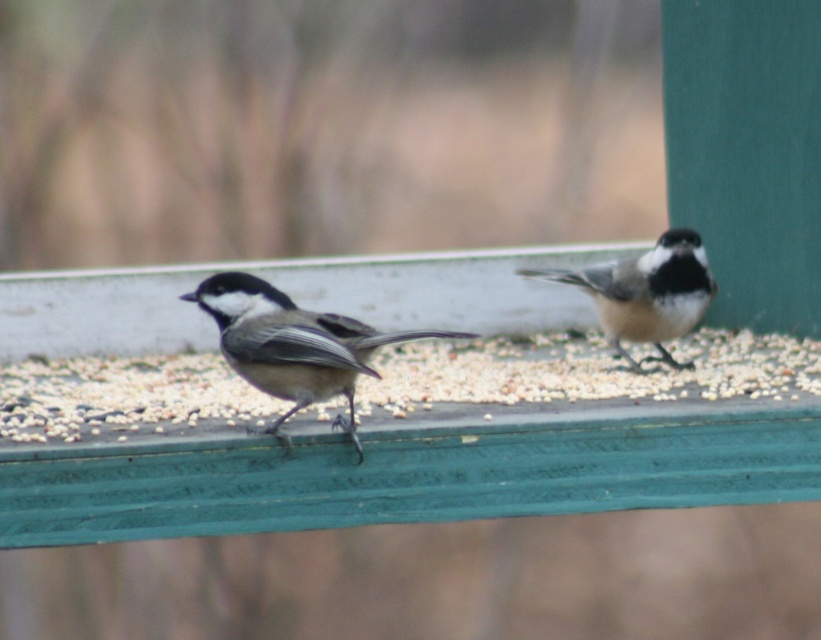
Is point (260, 298) less distant than point (673, 300)?

Yes, it is in front of point (673, 300).

Which is below, gray matte bird at center or white speckled feathers at center?

gray matte bird at center is below.

Describe the element at coordinates (292, 346) in the screenshot. I see `gray matte bird at center` at that location.

Where is `gray matte bird at center`? Image resolution: width=821 pixels, height=640 pixels. gray matte bird at center is located at coordinates (292, 346).